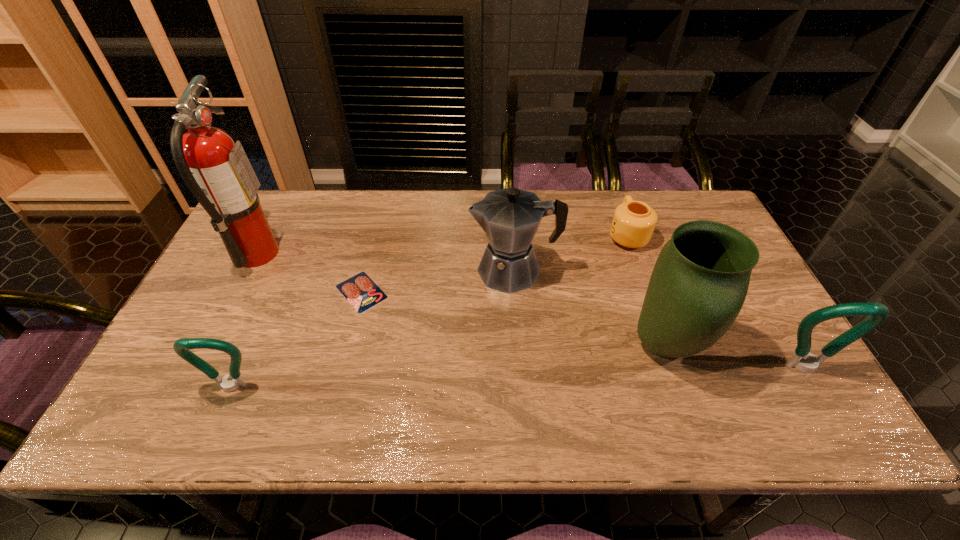
This screenshot has height=540, width=960. What are the coordinates of `fire extinguisher that is at the far edge` in the screenshot? It's located at (217, 171).

This screenshot has width=960, height=540. What are the coordinates of `vase that is at the near edge` in the screenshot? It's located at (699, 283).

At what (x,y) coordinates should I click in order to perform the action: click on bottle opener that is positioned at the left edge. Please return your answer as a coordinate pair (x, y). The width and height of the screenshot is (960, 540). Looking at the image, I should click on (181, 346).

This screenshot has height=540, width=960. I want to click on fire extinguisher located in the left edge section of the desktop, so 217,171.

Identify the location of object at the right edge. (802, 359).

Locate an element on the screen. object that is at the far left corner is located at coordinates (217, 171).

Where is `object present at the near left corner`? The image size is (960, 540). object present at the near left corner is located at coordinates (181, 346).

At what (x,y) coordinates should I click in order to perform the action: click on object that is at the near right corner. Please return your answer as a coordinate pair (x, y). The height and width of the screenshot is (540, 960). Looking at the image, I should click on (x=802, y=359).

The image size is (960, 540). In the image, there is a desktop. In order to click on vacant space at the far edge in this screenshot , I will do `click(349, 206)`.

Locate an element on the screen. The image size is (960, 540). vacant space at the near edge of the desktop is located at coordinates (528, 389).